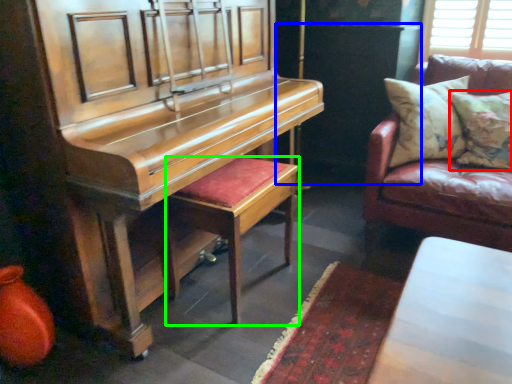
Question: Considering the real-world distances, which object is closest to pillow (highlighted by a red box)? dark (highlighted by a blue box) or stool (highlighted by a green box).

Choices:
 (A) dark
 (B) stool

Answer: (A)